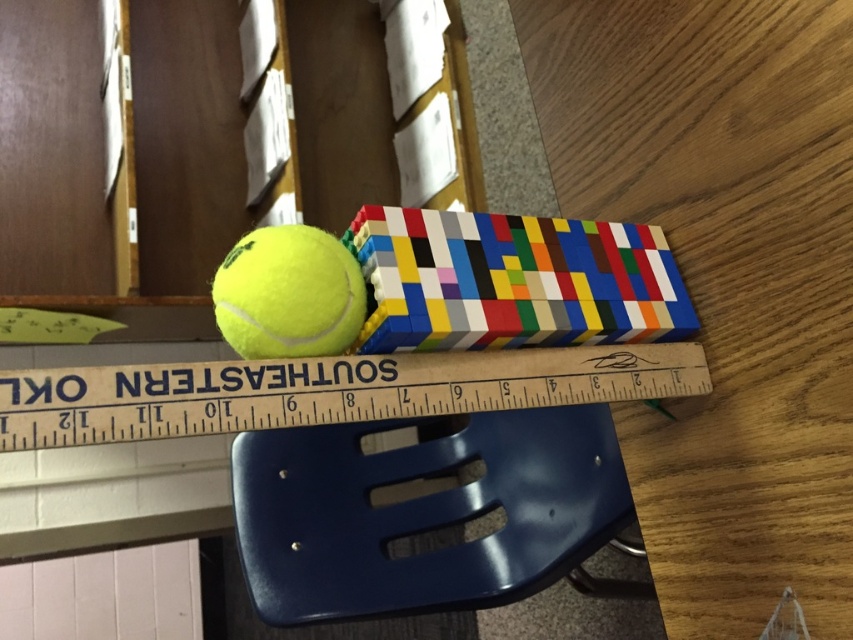
Between blue plastic chair at lower center and yellow matte tennis ball at center, which one is positioned lower?

Positioned lower is blue plastic chair at lower center.

Measure the distance between blue plastic chair at lower center and yellow matte tennis ball at center.

The distance of blue plastic chair at lower center from yellow matte tennis ball at center is 68.26 centimeters.

Who is more distant from viewer, (x=357, y=442) or (x=260, y=268)?

Point (x=357, y=442)

At what (x,y) coordinates should I click in order to perform the action: click on blue plastic chair at lower center. Please return your answer as a coordinate pair (x, y). The image size is (853, 640). Looking at the image, I should click on (422, 513).

Can you confirm if blue plastic chair at lower center is wider than wooden ruler at center?

Indeed, blue plastic chair at lower center has a greater width compared to wooden ruler at center.

Consider the image. Between blue plastic chair at lower center and wooden ruler at center, which one is positioned higher?

wooden ruler at center is higher up.

Locate an element on the screen. This screenshot has width=853, height=640. blue plastic chair at lower center is located at coordinates pos(422,513).

Which is behind, point (86, 406) or point (221, 304)?

Point (221, 304)

Measure the distance from wooden ruler at center to yellow matte tennis ball at center.

wooden ruler at center and yellow matte tennis ball at center are 3.76 inches apart.

The height and width of the screenshot is (640, 853). I want to click on wooden ruler at center, so click(326, 390).

The width and height of the screenshot is (853, 640). I want to click on wooden ruler at center, so click(326, 390).